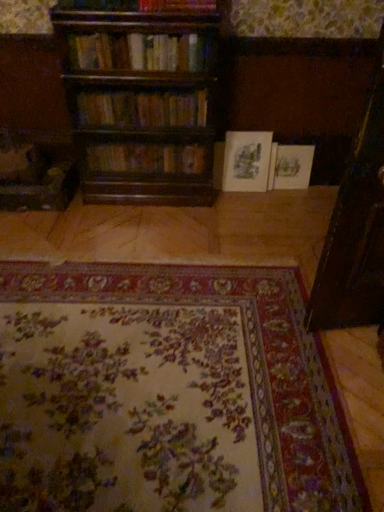
Question: Considering the positions of matte paper book at center, the fourth book viewed from the front, and floral carpet at center in the image, is matte paper book at center, the fourth book viewed from the front, taller or shorter than floral carpet at center?

Choices:
 (A) tall
 (B) short

Answer: (A)

Question: Is point (231, 167) closer or farther from the camera than point (115, 428)?

Choices:
 (A) closer
 (B) farther

Answer: (B)

Question: Estimate the real-world distances between objects in this image. Which object is farther from the matte paper book at center, the fourth book viewed from the front?

Choices:
 (A) wooden bookshelf at upper center, the first book from the front
 (B) white paper book at center, the 1th book positioned from the back
 (C) floral carpet at center
 (D) wooden bookshelf at center, marked as the second book in a front-to-back arrangement
 (E) wooden bookshelf at center, which appears as the third book when viewed from the front

Answer: (C)

Question: Which of these objects is positioned closest to the wooden bookshelf at center, the 3th book in the back-to-front sequence?

Choices:
 (A) wooden bookshelf at center, placed as the 4th book when sorted from back to front
 (B) matte paper book at center, arranged as the second book when viewed from the back
 (C) wooden bookshelf at upper center, the fifth book viewed from the back
 (D) white paper book at center, the 5th book in the front-to-back sequence
 (E) floral carpet at center

Answer: (A)